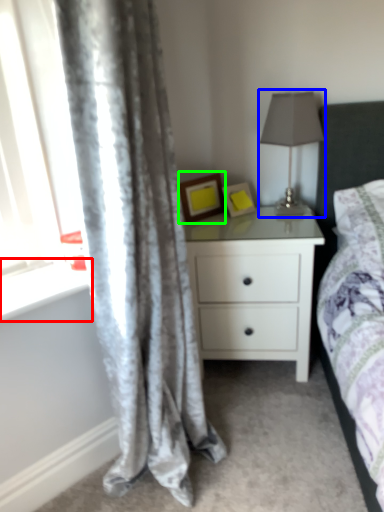
Question: Which is farther away from window sill (highlighted by a red box)? table lamp (highlighted by a blue box) or picture frame (highlighted by a green box)?

Choices:
 (A) table lamp
 (B) picture frame

Answer: (A)